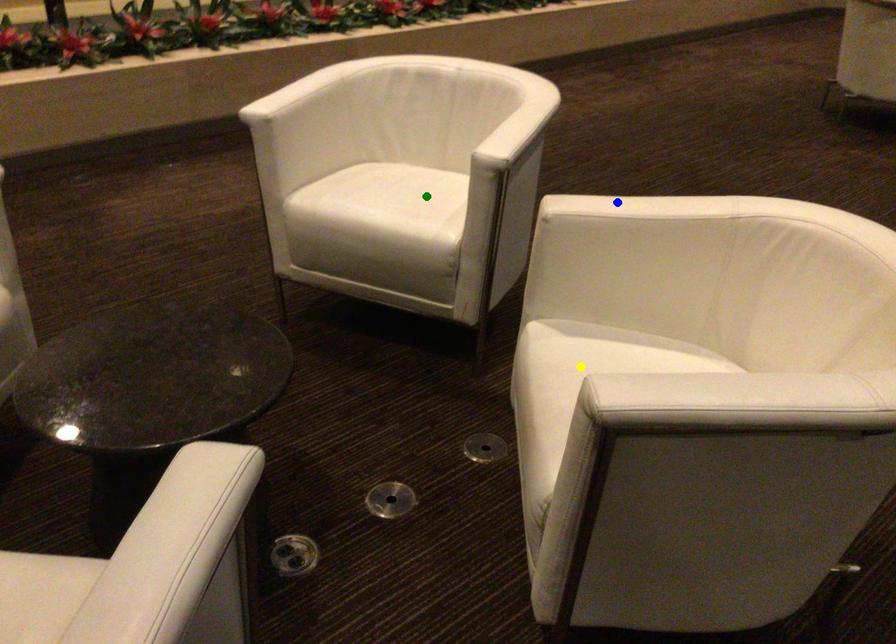
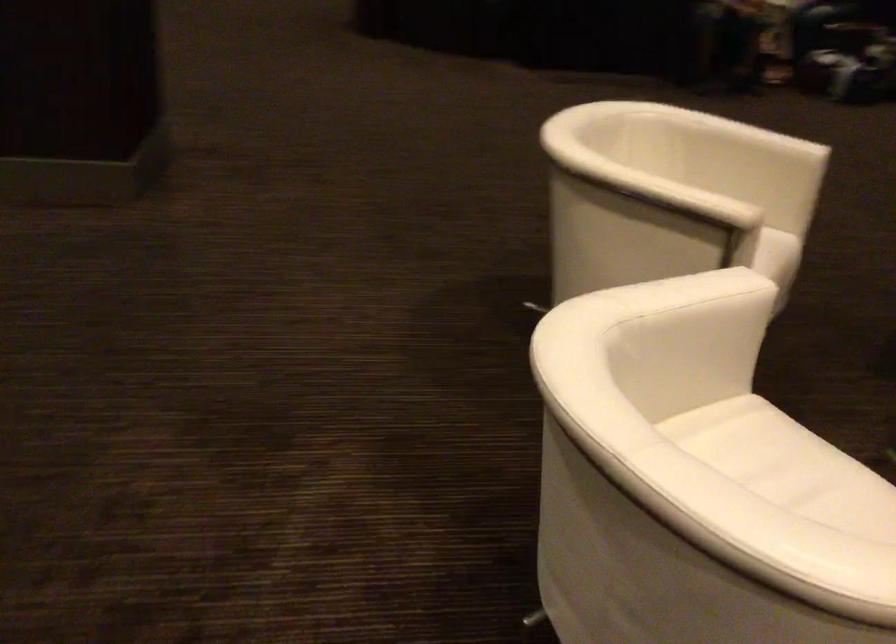
I am providing you with two images of the same scene from different viewpoints. Three points are marked in image1. Which point corresponds to a part or object that is occluded in image2?In image1, three points are marked. Which of them correspond to a part or object that is occluded in image2?Among the three points shown in image1, which one corresponds to a part or object that is no longer visible due to occlusion in image2?

yellow point